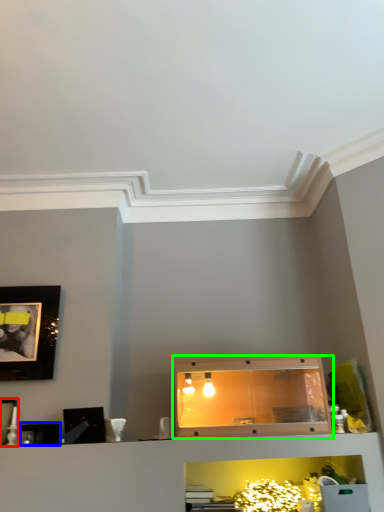
Question: Based on their relative distances, which object is nearer to picture frame (highlighted by a red box)? Choose from picture frame (highlighted by a blue box) and cabinetry (highlighted by a green box).

Choices:
 (A) picture frame
 (B) cabinetry

Answer: (A)